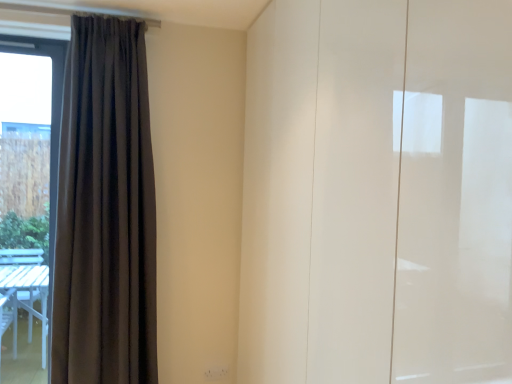
Measure the distance between white glossy cabinet at right and camera.

white glossy cabinet at right is 26.69 inches away from camera.

Find the location of `white glossy cabinet at right`. white glossy cabinet at right is located at coordinates (416, 193).

What do you see at coordinates (416, 193) in the screenshot? I see `white glossy cabinet at right` at bounding box center [416, 193].

In order to face white glossy cabinet at right, should I rotate leftwards or rightwards?

You should rotate right by 14.493 degrees.

Looking at this image, what is the approximate height of white glossy cabinet at right?

It is 6.72 feet.

What do you see at coordinates (105, 211) in the screenshot? The width and height of the screenshot is (512, 384). I see `dark grey fabric curtain at left` at bounding box center [105, 211].

This screenshot has width=512, height=384. What are the coordinates of `dark grey fabric curtain at left` in the screenshot? It's located at (105, 211).

What are the coordinates of `white glossy cabinet at right` in the screenshot? It's located at (416, 193).

Considering the positions of objects dark grey fabric curtain at left and white glossy cabinet at right in the image provided, who is more to the right, dark grey fabric curtain at left or white glossy cabinet at right?

white glossy cabinet at right is more to the right.

Is dark grey fabric curtain at left behind white glossy cabinet at right?

That is True.

Is point (65, 69) closer or farther from the camera than point (415, 197)?

Point (65, 69) is positioned farther from the camera compared to point (415, 197).

From the image's perspective, is dark grey fabric curtain at left on white glossy cabinet at right?

Indeed, from the image's perspective, dark grey fabric curtain at left is shown above white glossy cabinet at right.

From a real-world perspective, between dark grey fabric curtain at left and white glossy cabinet at right, who is vertically higher?

dark grey fabric curtain at left, from a real-world perspective.

Can you confirm if dark grey fabric curtain at left is wider than white glossy cabinet at right?

No.

Does dark grey fabric curtain at left have a lesser height compared to white glossy cabinet at right?

Indeed, dark grey fabric curtain at left has a lesser height compared to white glossy cabinet at right.

Who is smaller, dark grey fabric curtain at left or white glossy cabinet at right?

dark grey fabric curtain at left is smaller.

Is dark grey fabric curtain at left inside the boundaries of white glossy cabinet at right, or outside?

dark grey fabric curtain at left cannot be found inside white glossy cabinet at right.

Is there a large distance between dark grey fabric curtain at left and white glossy cabinet at right?

dark grey fabric curtain at left is positioned a significant distance from white glossy cabinet at right.

Is dark grey fabric curtain at left turned away from white glossy cabinet at right?

dark grey fabric curtain at left does not have its back to white glossy cabinet at right.

How much distance is there between dark grey fabric curtain at left and white glossy cabinet at right?

A distance of 4.68 feet exists between dark grey fabric curtain at left and white glossy cabinet at right.

Locate an element on the screen. Image resolution: width=512 pixels, height=384 pixels. curtain above the white glossy cabinet at right (from the image's perspective) is located at coordinates (105, 211).

Which object is positioned more to the left, white glossy cabinet at right or dark grey fabric curtain at left?

dark grey fabric curtain at left is more to the left.

Considering their positions, is white glossy cabinet at right located in front of or behind dark grey fabric curtain at left?

white glossy cabinet at right is positioned closer to the viewer than dark grey fabric curtain at left.

Between point (504, 200) and point (144, 323), which one is positioned in front?

The point (504, 200) is in front.

Consider the image. From the image's perspective, relative to dark grey fabric curtain at left, is white glossy cabinet at right above or below?

From the image's perspective, white glossy cabinet at right appears below dark grey fabric curtain at left.

From a real-world perspective, is white glossy cabinet at right physically above dark grey fabric curtain at left?

No.

In terms of width, does white glossy cabinet at right look wider or thinner when compared to dark grey fabric curtain at left?

Considering their sizes, white glossy cabinet at right looks broader than dark grey fabric curtain at left.

Between white glossy cabinet at right and dark grey fabric curtain at left, which one has less height?

dark grey fabric curtain at left.

Looking at the image, does white glossy cabinet at right seem bigger or smaller compared to dark grey fabric curtain at left?

Clearly, white glossy cabinet at right is larger in size than dark grey fabric curtain at left.

From the picture: Is white glossy cabinet at right inside or outside of dark grey fabric curtain at left?

The correct answer is: outside.

From the picture: Are white glossy cabinet at right and dark grey fabric curtain at left making contact?

No, white glossy cabinet at right is not making contact with dark grey fabric curtain at left.

Does white glossy cabinet at right turn towards dark grey fabric curtain at left?

Yes, white glossy cabinet at right is oriented towards dark grey fabric curtain at left.

At what (x,y) coordinates should I click in order to perform the action: click on screen door in front of the dark grey fabric curtain at left. Please return your answer as a coordinate pair (x, y). Looking at the image, I should click on (416, 193).

The height and width of the screenshot is (384, 512). In the image, there is a dark grey fabric curtain at left. What are the coordinates of `screen door below it (from a real-world perspective)` in the screenshot? It's located at (416, 193).

Locate an element on the screen. The height and width of the screenshot is (384, 512). curtain above the white glossy cabinet at right (from the image's perspective) is located at coordinates [105, 211].